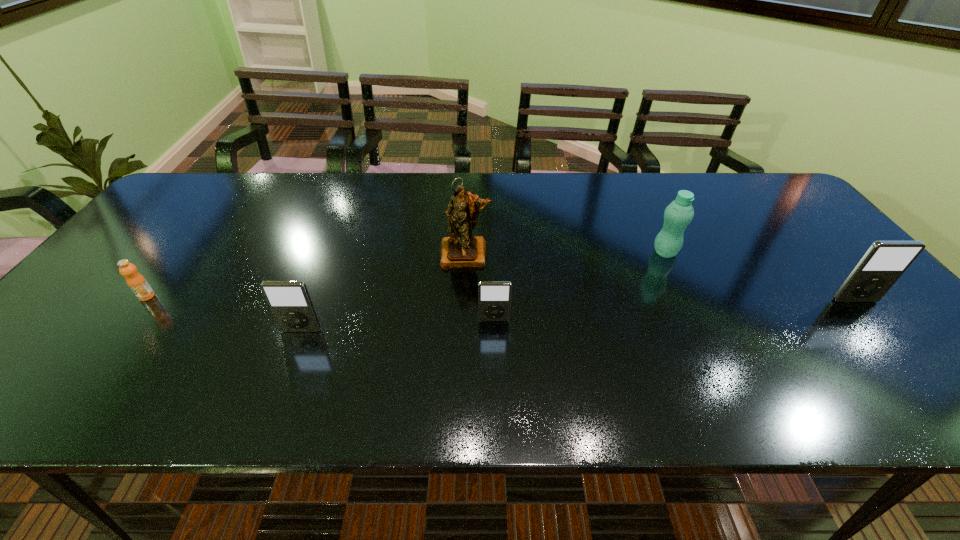
Image resolution: width=960 pixels, height=540 pixels. I want to click on free spot between the bottle and the orange juice, so click(406, 274).

Select which object is the closest to the farthest iPod. Please provide its 2D coordinates. Your answer should be formatted as a tuple, i.e. [(x, y)], where the tuple contains the x and y coordinates of a point satisfying the conditions above.

[(679, 213)]

This screenshot has height=540, width=960. In order to click on the fourth closest object to the bottle in this screenshot , I will do `click(289, 301)`.

I want to click on iPod object that ranks as the closest to the leftmost object, so click(289, 301).

The image size is (960, 540). I want to click on iPod that is the closest to the figurine, so click(494, 297).